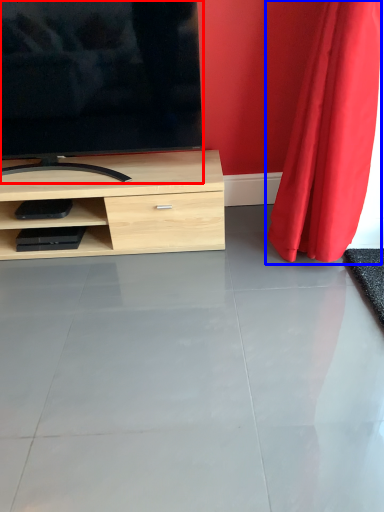
Question: Which object appears farthest to the camera in this image, television (highlighted by a red box) or curtain (highlighted by a blue box)?

Choices:
 (A) television
 (B) curtain

Answer: (A)